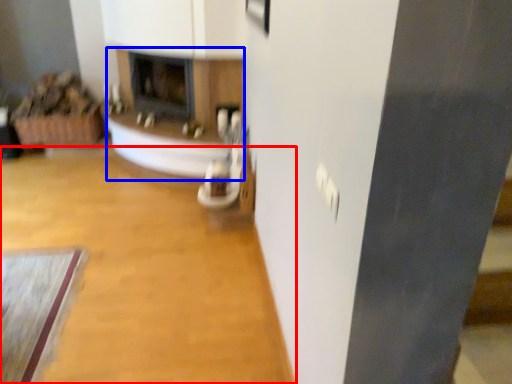
Question: Which object appears farthest to the camera in this image, plain (highlighted by a red box) or fireplace (highlighted by a blue box)?

Choices:
 (A) plain
 (B) fireplace

Answer: (B)